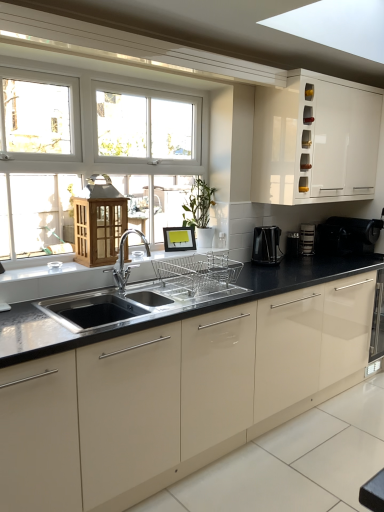
Question: Relative to black glossy countertop at center, is black plastic coffee machine at right, which ranks as the 2th coffee machine in back-to-front order, in front or behind?

Choices:
 (A) behind
 (B) front

Answer: (A)

Question: From the image's perspective, is black plastic coffee machine at right, which ranks as the first coffee machine in front-to-back order, located above or below black glossy countertop at center?

Choices:
 (A) below
 (B) above

Answer: (B)

Question: Estimate the real-world distances between objects in this image. Which object is closer to the black glossy countertop at center?

Choices:
 (A) black plastic coffee maker at right, which appears as the second appliance when viewed from the left
 (B) white glossy cabinet at upper right
 (C) polished chrome faucet at center
 (D) black plastic coffee maker at center right, the first appliance in the left-to-right sequence
 (E) black plastic coffee machine at right, the first coffee machine in the back-to-front sequence

Answer: (C)

Question: Which is farther from the black plastic coffee maker at right, which appears as the second appliance when viewed from the left?

Choices:
 (A) white glossy cabinet at upper right
 (B) black plastic coffee maker at center right, marked as the second appliance in a right-to-left arrangement
 (C) black glossy countertop at center
 (D) black plastic coffee machine at right, marked as the first coffee machine in a left-to-right arrangement
 (E) polished chrome faucet at center

Answer: (E)